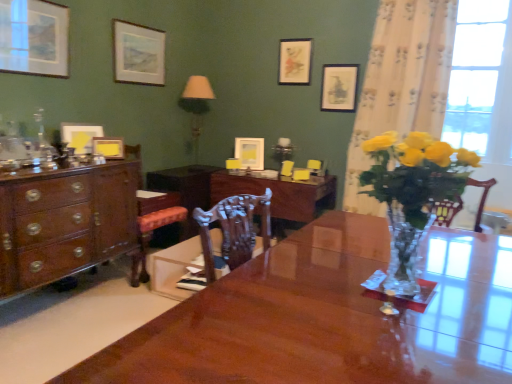
You are a GUI agent. You are given a task and a screenshot of the screen. Output one action in this format:
    pyautogui.click(x=<x>, y=<y>)
    Task: Click on the free spot behind translucent glass vase at center
    
    Given the screenshot: What is the action you would take?
    pyautogui.click(x=389, y=253)